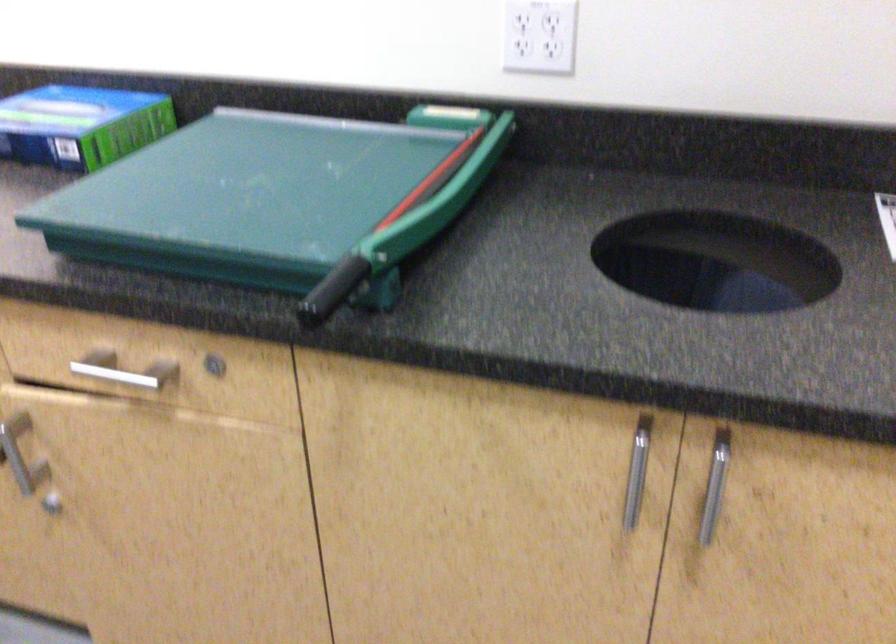
Locate an element on the screen. The image size is (896, 644). silver cabinet lock is located at coordinates (714, 486).